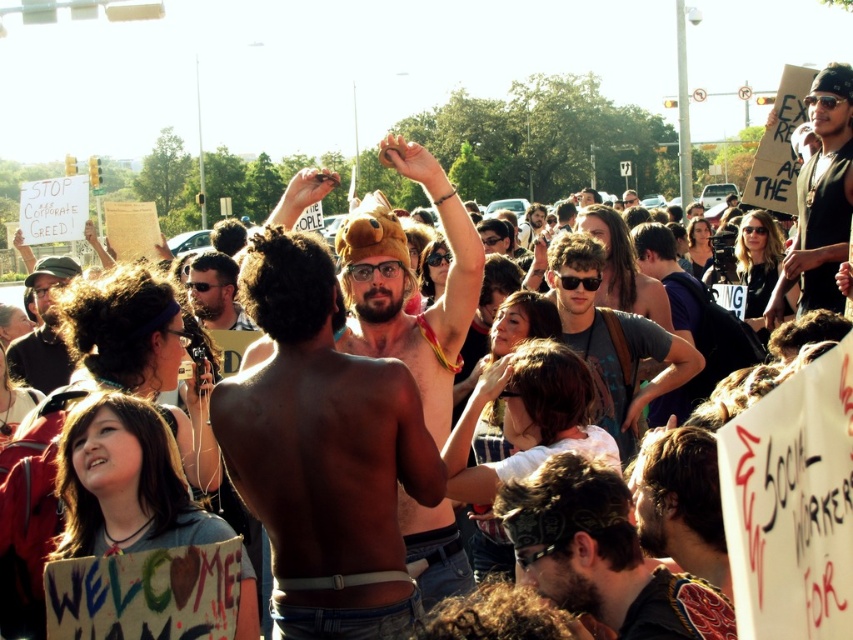
Question: Which point appears farthest from the camera in this image?

Choices:
 (A) (44, 362)
 (B) (585, 333)
 (C) (595, 609)
 (D) (300, 509)

Answer: (A)

Question: Is matte black shirt at upper right wider than dark brown leather jacket at lower right?

Choices:
 (A) no
 (B) yes

Answer: (B)

Question: Estimate the real-world distances between objects in this image. Which object is closer to the matte black shirt at upper right?

Choices:
 (A) dark brown leather jacket at center
 (B) matte black shirt at left

Answer: (A)

Question: Does shiny metallic tank top at center come behind matte black shirt at upper right?

Choices:
 (A) yes
 (B) no

Answer: (B)

Question: Is shiny gold headband at center closer to the viewer compared to matte black shirt at left?

Choices:
 (A) yes
 (B) no

Answer: (A)

Question: Which object is the closest to the dark brown leather jacket at lower right?

Choices:
 (A) shiny metallic tank top at center
 (B) matte black shirt at left

Answer: (A)